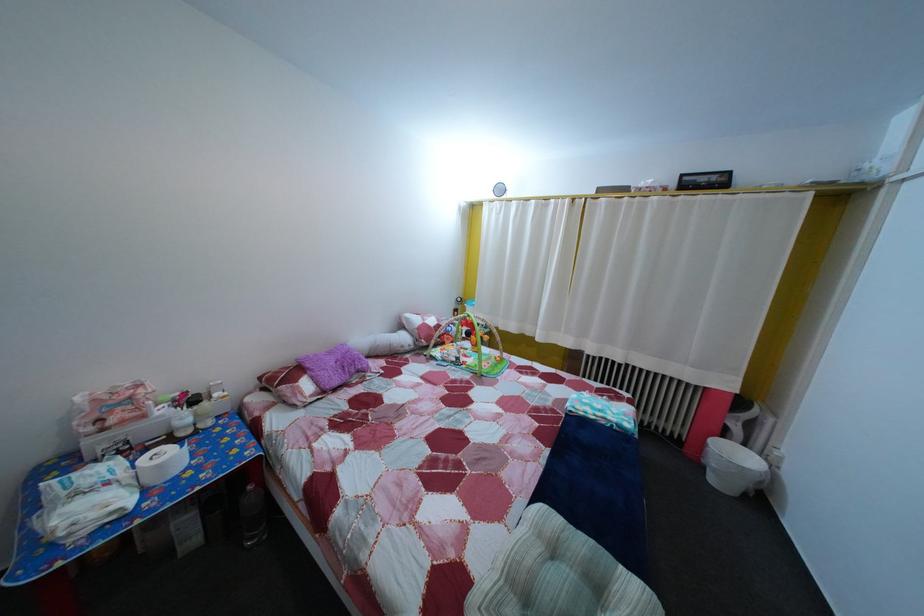
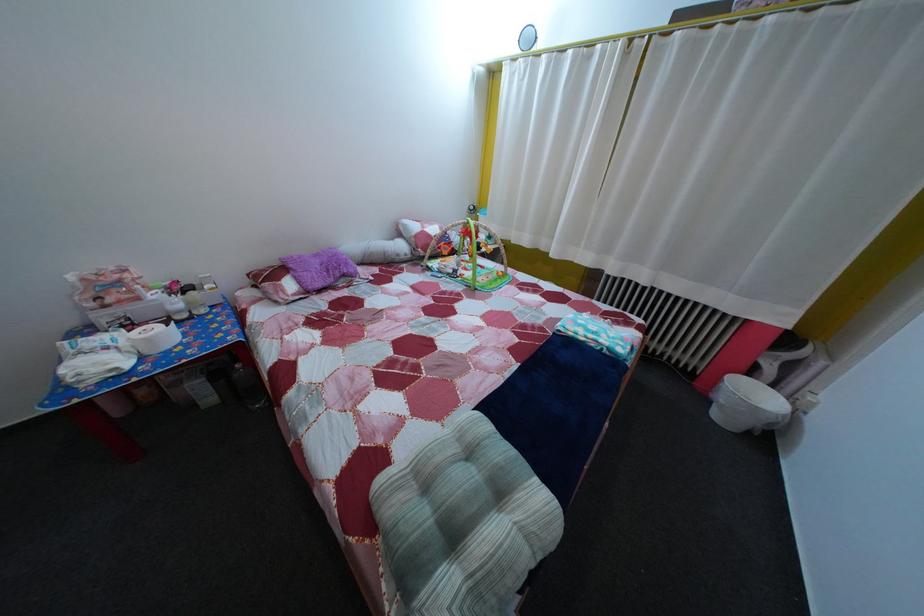
Where in the second image is the point corresponding to the point at 587,415 from the first image?

(578, 334)